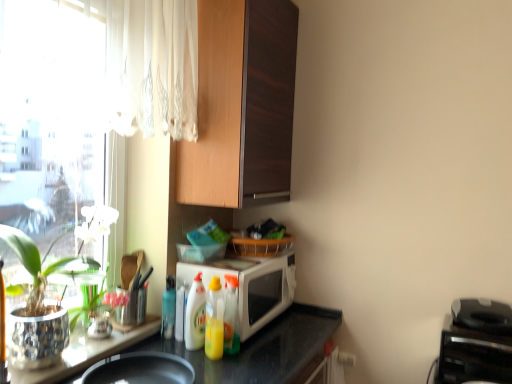
This screenshot has height=384, width=512. Describe the element at coordinates (231, 316) in the screenshot. I see `translucent plastic bottle at center, acting as the first bottle starting from the right` at that location.

What are the coordinates of `translucent plastic bottle at center, positioned as the 4th bottle in left-to-right order` in the screenshot? It's located at (231, 316).

Measure the distance between point (101, 358) and camera.

Point (101, 358) is 1.36 meters from camera.

Identify the location of shiny metallic pot at left. Image resolution: width=512 pixels, height=384 pixels. (44, 290).

The image size is (512, 384). In order to click on wooden cabinet at upper center in this screenshot , I will do `click(241, 105)`.

In order to face wooden cabinet at upper center, should I rotate leftwards or rightwards?

You should look left and rotate roughly 2.016 degrees.

This screenshot has height=384, width=512. In order to click on yellow translucent bottle at center, the second bottle in the right-to-left sequence in this screenshot , I will do `click(214, 320)`.

Locate an element on the screen. The width and height of the screenshot is (512, 384). white glossy microwave at center is located at coordinates (251, 286).

Image resolution: width=512 pixels, height=384 pixels. I want to click on translucent plastic bottle at center, positioned as the 4th bottle in left-to-right order, so click(x=231, y=316).

From a real-world perspective, which object stands above the other?

In real-world perspective, shiny metallic pot at left is above.

Would you say shiny metallic pot at left contains metallic silver table at lower left?

No.

Can you confirm if shiny metallic pot at left is thinner than metallic silver table at lower left?

Yes.

Is black plastic toaster at lower right in front of metallic silver table at lower left?

No, it is behind metallic silver table at lower left.

Does black plastic toaster at lower right have a lesser height compared to metallic silver table at lower left?

No.

From a real-world perspective, who is located lower, black plastic toaster at lower right or metallic silver table at lower left?

In real-world perspective, black plastic toaster at lower right is lower.

How far apart are black plastic toaster at lower right and metallic silver table at lower left?

1.22 meters.

Looking at this image, is yellow translucent bottle at center, the second bottle in the right-to-left sequence, at the right side of wooden cabinet at upper center?

In fact, yellow translucent bottle at center, the second bottle in the right-to-left sequence, is to the left of wooden cabinet at upper center.

Is yellow translucent bottle at center, the second bottle in the right-to-left sequence, outside of wooden cabinet at upper center?

Indeed, yellow translucent bottle at center, the second bottle in the right-to-left sequence, is completely outside wooden cabinet at upper center.

Is yellow translucent bottle at center, which appears as the 3th bottle when viewed from the left, aimed at wooden cabinet at upper center?

No, yellow translucent bottle at center, which appears as the 3th bottle when viewed from the left, is not facing towards wooden cabinet at upper center.

Which object is thinner, wooden cabinet at upper center or yellow translucent bottle at center, which appears as the 3th bottle when viewed from the left?

yellow translucent bottle at center, which appears as the 3th bottle when viewed from the left.

Is there a large distance between wooden cabinet at upper center and yellow translucent bottle at center, the second bottle in the right-to-left sequence?

No, there isn't a large distance between wooden cabinet at upper center and yellow translucent bottle at center, the second bottle in the right-to-left sequence.

From a real-world perspective, is wooden cabinet at upper center physically located above or below yellow translucent bottle at center, the second bottle in the right-to-left sequence?

wooden cabinet at upper center is situated higher than yellow translucent bottle at center, the second bottle in the right-to-left sequence, in the real world.

Which is less distant, (x=216, y=50) or (x=212, y=289)?

The point (x=212, y=289) is closer to the camera.

Which bottle is the 3rd one when counting from the left side of the white glossy microwave at center? Please provide its 2D coordinates.

[(195, 315)]

Is white glossy microwave at center smaller than white glossy bottle at center, which is the 2th bottle from left to right?

No.

Could you tell me if white glossy microwave at center is facing white glossy bottle at center, the third bottle in the right-to-left sequence?

No.

Is translucent plastic bottle at center, positioned as the 4th bottle in left-to-right order, with black plastic toaster at lower right?

No.

Is translucent plastic bottle at center, positioned as the 4th bottle in left-to-right order, to the left or to the right of black plastic toaster at lower right in the image?

Based on their positions, translucent plastic bottle at center, positioned as the 4th bottle in left-to-right order, is located to the left of black plastic toaster at lower right.

Considering the relative sizes of translucent plastic bottle at center, positioned as the 4th bottle in left-to-right order, and black plastic toaster at lower right in the image provided, is translucent plastic bottle at center, positioned as the 4th bottle in left-to-right order, wider than black plastic toaster at lower right?

Incorrect, the width of translucent plastic bottle at center, positioned as the 4th bottle in left-to-right order, does not surpass that of black plastic toaster at lower right.

Is translucent plastic bottle at center, acting as the first bottle starting from the right, oriented away from black plastic toaster at lower right?

No, translucent plastic bottle at center, acting as the first bottle starting from the right, is not facing the opposite direction of black plastic toaster at lower right.

Which of these two, metallic silver table at lower left or white glossy bottle at center, the third bottle in the right-to-left sequence, stands taller?

With more height is white glossy bottle at center, the third bottle in the right-to-left sequence.

Between metallic silver table at lower left and white glossy bottle at center, the third bottle in the right-to-left sequence, which one appears on the left side from the viewer's perspective?

metallic silver table at lower left.

Where is `the 4th bottle above the metallic silver table at lower left (from the image's perspective)`? The width and height of the screenshot is (512, 384). the 4th bottle above the metallic silver table at lower left (from the image's perspective) is located at coordinates (195, 315).

Are metallic silver table at lower left and white glossy bottle at center, the third bottle in the right-to-left sequence, beside each other?

No, metallic silver table at lower left is not beside white glossy bottle at center, the third bottle in the right-to-left sequence.

In the image, there is a metallic silver table at lower left. Where is `houseplant above it (from the image's perspective)`? houseplant above it (from the image's perspective) is located at coordinates (44, 290).

Where is `table above the black plastic toaster at lower right (from a real-world perspective)`? This screenshot has width=512, height=384. table above the black plastic toaster at lower right (from a real-world perspective) is located at coordinates (86, 352).

Looking at the image, which one is located closer to shiny metallic pot at left, yellow translucent bottle at center, the second bottle in the right-to-left sequence, or white glossy bottle at center, the third bottle in the right-to-left sequence?

white glossy bottle at center, the third bottle in the right-to-left sequence, is closer to shiny metallic pot at left.

Considering their positions, is shiny metallic pot at left positioned closer to metallic silver table at lower left than translucent plastic bottle at center, which is the 1th bottle from left to right?

Among the two, shiny metallic pot at left is located nearer to metallic silver table at lower left.

Considering their positions, is metallic silver table at lower left positioned closer to black plastic toaster at lower right than translucent plastic bottle at center, acting as the first bottle starting from the right?

The object closer to black plastic toaster at lower right is translucent plastic bottle at center, acting as the first bottle starting from the right.

Consider the image. Based on their spatial positions, is shiny metallic pot at left or yellow translucent bottle at center, which appears as the 3th bottle when viewed from the left, closer to white glossy bottle at center, the third bottle in the right-to-left sequence?

yellow translucent bottle at center, which appears as the 3th bottle when viewed from the left.

When comparing their distances from shiny metallic pot at left, does translucent plastic bottle at center, acting as the first bottle starting from the right, or black plastic toaster at lower right seem closer?

translucent plastic bottle at center, acting as the first bottle starting from the right.

When comparing their distances from white glossy bottle at center, the third bottle in the right-to-left sequence, does white glossy microwave at center or translucent plastic bottle at center, acting as the first bottle starting from the right, seem closer?

translucent plastic bottle at center, acting as the first bottle starting from the right.

Considering their positions, is translucent plastic bottle at center, positioned as the 4th bottle in left-to-right order, positioned closer to white glossy microwave at center than yellow translucent bottle at center, which appears as the 3th bottle when viewed from the left?

translucent plastic bottle at center, positioned as the 4th bottle in left-to-right order.

Looking at the image, which one is located further to white glossy microwave at center, metallic silver table at lower left or black plastic toaster at lower right?

black plastic toaster at lower right.

Identify the location of microwave oven between wooden cabinet at upper center and metallic silver table at lower left from top to bottom. The width and height of the screenshot is (512, 384). (251, 286).

In order to click on cabinetry situated between metallic silver table at lower left and black plastic toaster at lower right from left to right in this screenshot , I will do `click(241, 105)`.

The image size is (512, 384). What are the coordinates of `cabinetry located between white glossy bottle at center, the third bottle in the right-to-left sequence, and black plastic toaster at lower right in the left-right direction` in the screenshot? It's located at (241, 105).

Locate an element on the screen. The width and height of the screenshot is (512, 384). houseplant between wooden cabinet at upper center and white glossy bottle at center, the third bottle in the right-to-left sequence, from top to bottom is located at coordinates (44, 290).